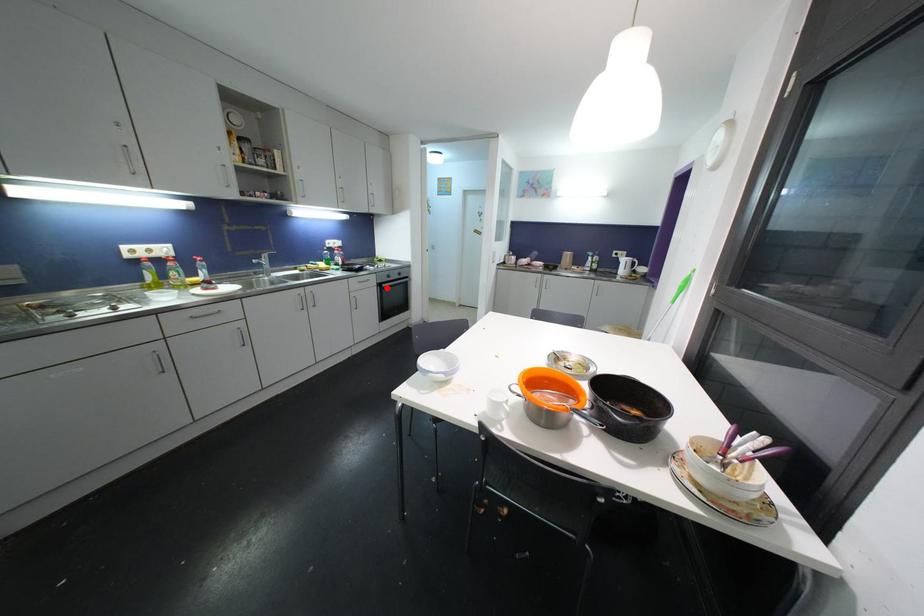
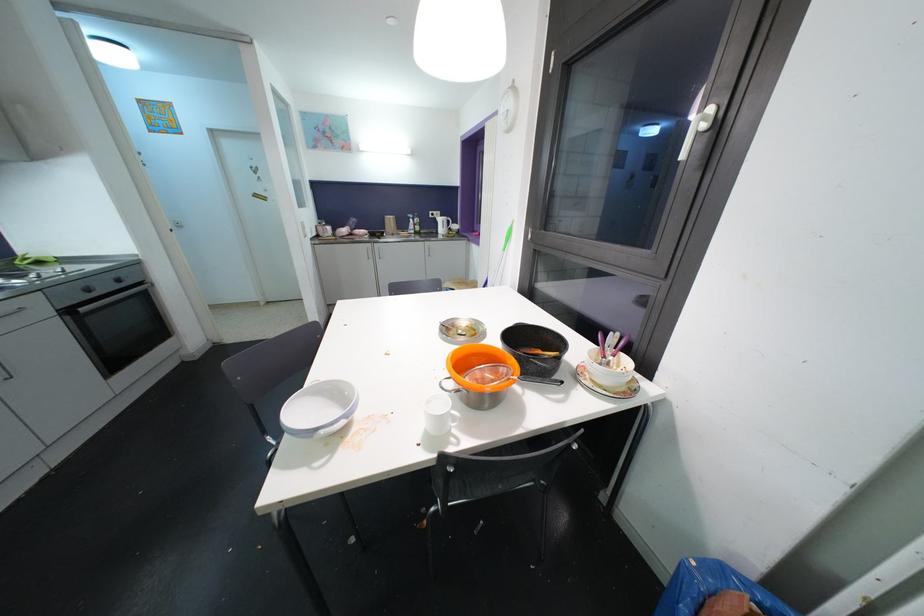
Question: I am providing you with two images of the same scene from different viewpoints. A red point is shown in image1. For the corresponding object point in image2, is it positioned nearer or farther from the camera?

Choices:
 (A) Nearer
 (B) Farther

Answer: (B)